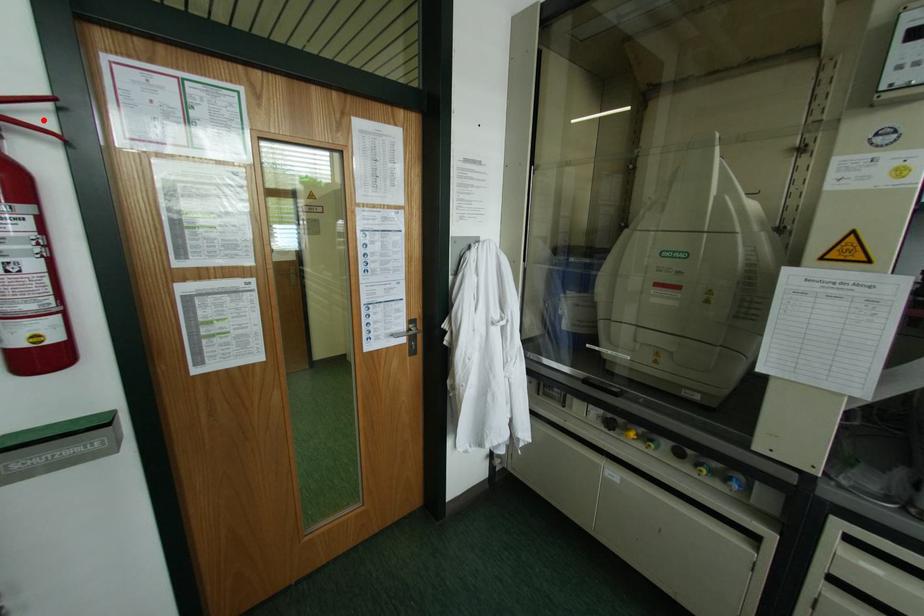
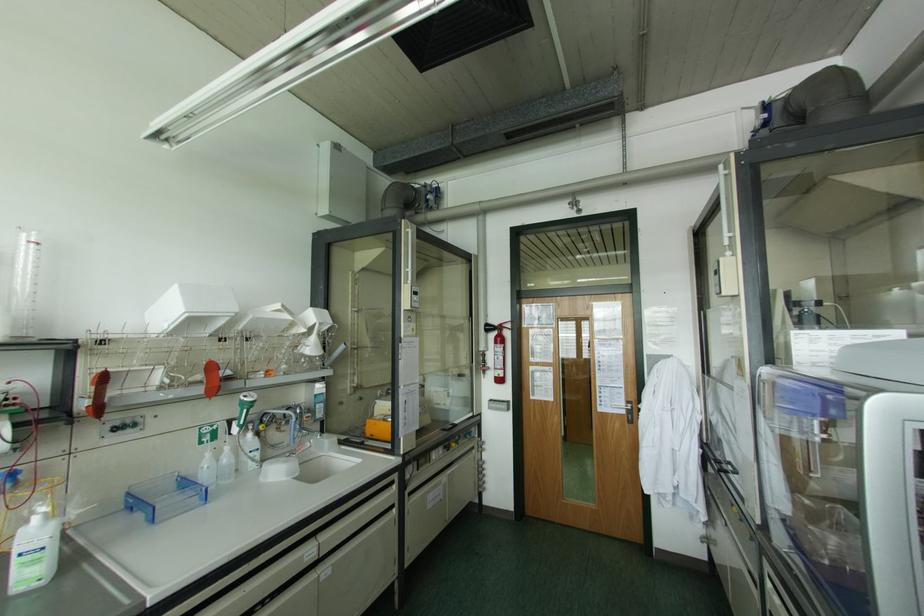
The point at the highlighted location is marked in the first image. Where is the corresponding point in the second image?

(507, 325)